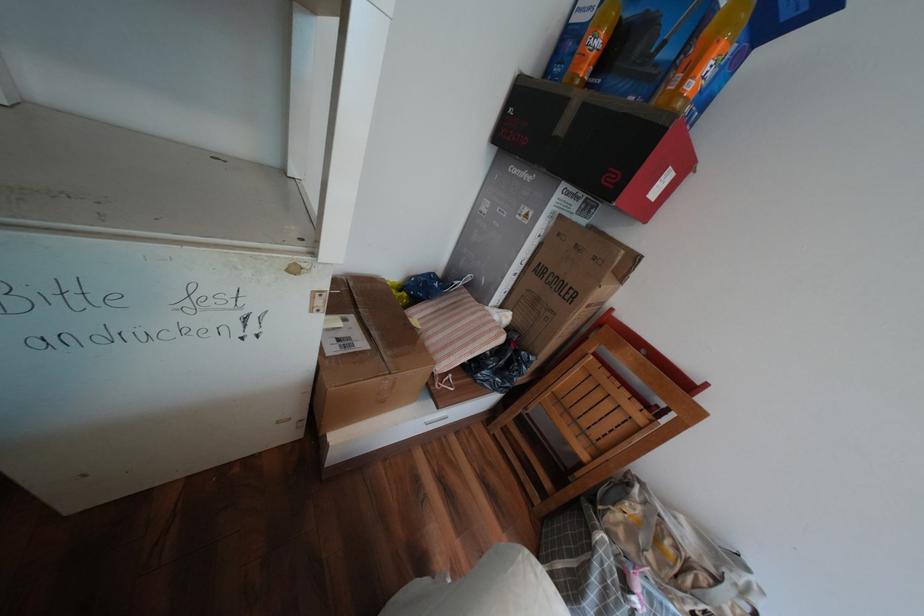
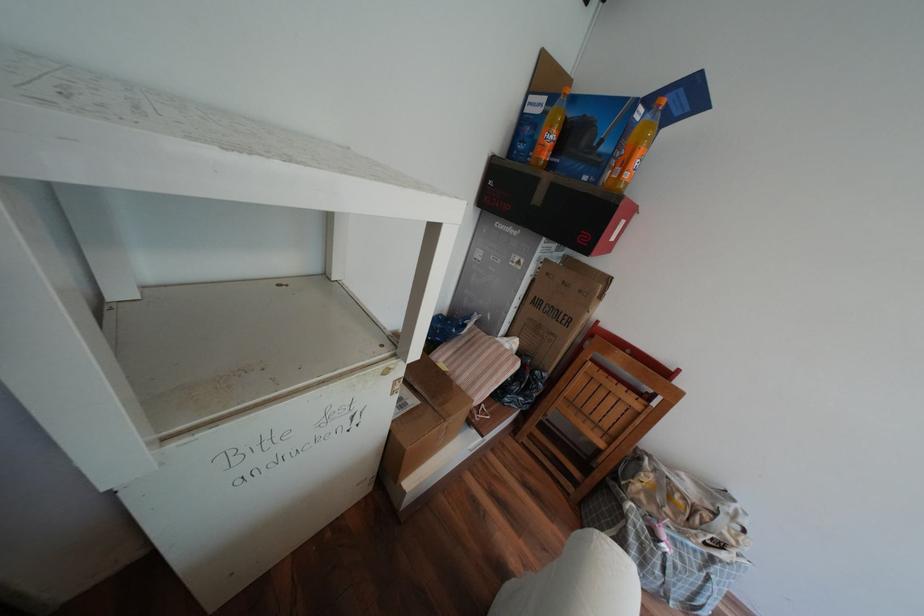
The point at (x=525, y=169) is marked in the first image. Where is the corresponding point in the second image?

(511, 225)